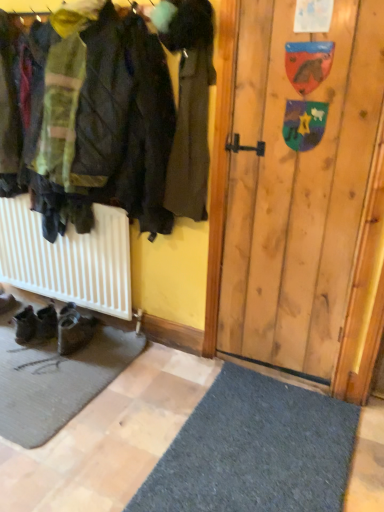
Question: Is there a large distance between dark brown leather coat at center and black leather shoes at lower left, which appears as the 1th footwear when viewed from the right?

Choices:
 (A) no
 (B) yes

Answer: (B)

Question: From a real-world perspective, does dark brown leather coat at center stand above black leather shoes at lower left, which appears as the 1th footwear when viewed from the right?

Choices:
 (A) no
 (B) yes

Answer: (B)

Question: Is dark brown leather coat at center smaller than black leather shoes at lower left, which appears as the 1th footwear when viewed from the right?

Choices:
 (A) no
 (B) yes

Answer: (A)

Question: Is dark brown leather coat at center taller than black leather shoes at lower left, which appears as the 1th footwear when viewed from the right?

Choices:
 (A) no
 (B) yes

Answer: (B)

Question: Is dark brown leather coat at center facing away from black leather shoes at lower left, which appears as the 1th footwear when viewed from the right?

Choices:
 (A) no
 (B) yes

Answer: (A)

Question: Is dark brown leather coat at center positioned beyond the bounds of black leather shoes at lower left, which appears as the 1th footwear when viewed from the right?

Choices:
 (A) no
 (B) yes

Answer: (B)

Question: Considering the relative positions of brown suede boots at lower left, the second footwear in the right-to-left sequence, and dark brown leather coat at center in the image provided, is brown suede boots at lower left, the second footwear in the right-to-left sequence, to the left of dark brown leather coat at center from the viewer's perspective?

Choices:
 (A) no
 (B) yes

Answer: (B)

Question: Considering the relative sizes of brown suede boots at lower left, the first footwear when ordered from left to right, and dark brown leather coat at center in the image provided, is brown suede boots at lower left, the first footwear when ordered from left to right, smaller than dark brown leather coat at center?

Choices:
 (A) no
 (B) yes

Answer: (B)

Question: Is brown suede boots at lower left, the second footwear in the right-to-left sequence, surrounding dark brown leather coat at center?

Choices:
 (A) yes
 (B) no

Answer: (B)

Question: Is brown suede boots at lower left, the first footwear when ordered from left to right, positioned with its back to dark brown leather coat at center?

Choices:
 (A) yes
 (B) no

Answer: (B)

Question: Considering the relative sizes of brown suede boots at lower left, the first footwear when ordered from left to right, and dark brown leather coat at center in the image provided, is brown suede boots at lower left, the first footwear when ordered from left to right, thinner than dark brown leather coat at center?

Choices:
 (A) no
 (B) yes

Answer: (A)

Question: Does brown suede boots at lower left, the first footwear when ordered from left to right, appear on the right side of dark brown leather coat at center?

Choices:
 (A) yes
 (B) no

Answer: (B)

Question: Is dark brown leather coat at center closer to the viewer compared to brown suede boots at lower left, the first footwear when ordered from left to right?

Choices:
 (A) no
 (B) yes

Answer: (B)